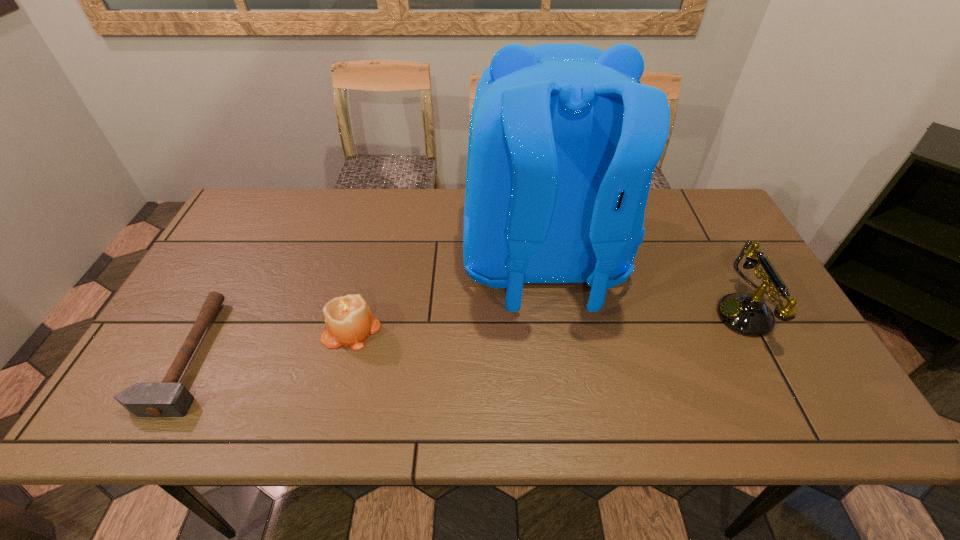
Locate an element on the screen. This screenshot has width=960, height=540. free spot located 0.250m on the dial of the rightmost object is located at coordinates (618, 314).

At what (x,y) coordinates should I click in order to perform the action: click on blank area located 0.080m on the dial of the rightmost object. Please return your answer as a coordinate pair (x, y). Looking at the image, I should click on (685, 314).

Image resolution: width=960 pixels, height=540 pixels. Find the location of `vacant space located on the right of the third tallest object`. vacant space located on the right of the third tallest object is located at coordinates (400, 330).

The height and width of the screenshot is (540, 960). What are the coordinates of `free space located 0.110m on the striking surface of the hammer` in the screenshot? It's located at (263, 355).

You are a GUI agent. You are given a task and a screenshot of the screen. Output one action in this format:
    pyautogui.click(x=<x>, y=<y>)
    Task: Click on the object that is at the far edge
    This screenshot has height=540, width=960.
    Given the screenshot: What is the action you would take?
    pyautogui.click(x=563, y=140)

The image size is (960, 540). What are the coordinates of `object present at the near edge` in the screenshot? It's located at (169, 398).

This screenshot has height=540, width=960. I want to click on object located in the left edge section of the desktop, so click(x=169, y=398).

Where is `object that is at the right edge`? This screenshot has height=540, width=960. object that is at the right edge is located at coordinates click(x=747, y=314).

Locate an element on the screen. This screenshot has height=540, width=960. object located at the near left corner is located at coordinates (169, 398).

The height and width of the screenshot is (540, 960). In the image, there is a desktop. Find the location of `vacant space at the far edge`. vacant space at the far edge is located at coordinates (368, 197).